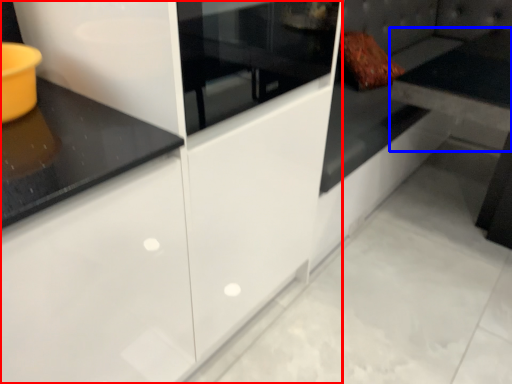
Question: Which object is closer to the camera taking this photo, cabinetry (highlighted by a red box) or table (highlighted by a blue box)?

Choices:
 (A) cabinetry
 (B) table

Answer: (A)